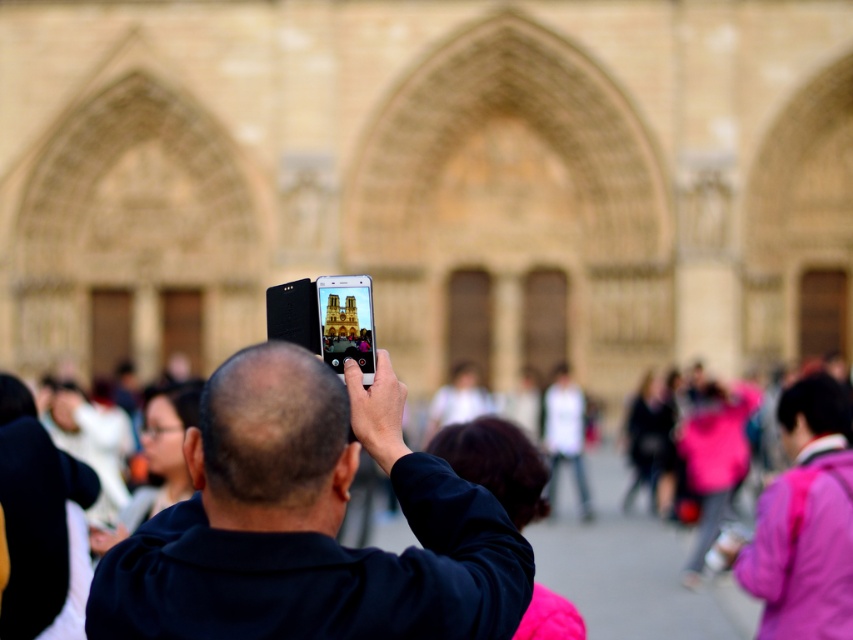
Question: Which object is closer to the camera taking this photo?

Choices:
 (A) black matte smartphone at center
 (B) dark blue fabric jacket at center

Answer: (B)

Question: Among these points, which one is farthest from the camera?

Choices:
 (A) (370, 355)
 (B) (271, 492)

Answer: (A)

Question: In this image, where is dark blue fabric jacket at center located relative to black matte smartphone at center?

Choices:
 (A) below
 (B) above

Answer: (A)

Question: Does dark blue fabric jacket at center lie behind black matte smartphone at center?

Choices:
 (A) no
 (B) yes

Answer: (A)

Question: Does dark blue fabric jacket at center appear on the right side of black matte smartphone at center?

Choices:
 (A) no
 (B) yes

Answer: (B)

Question: Which point appears farthest from the camera in this image?

Choices:
 (A) (341, 333)
 (B) (500, 627)

Answer: (A)